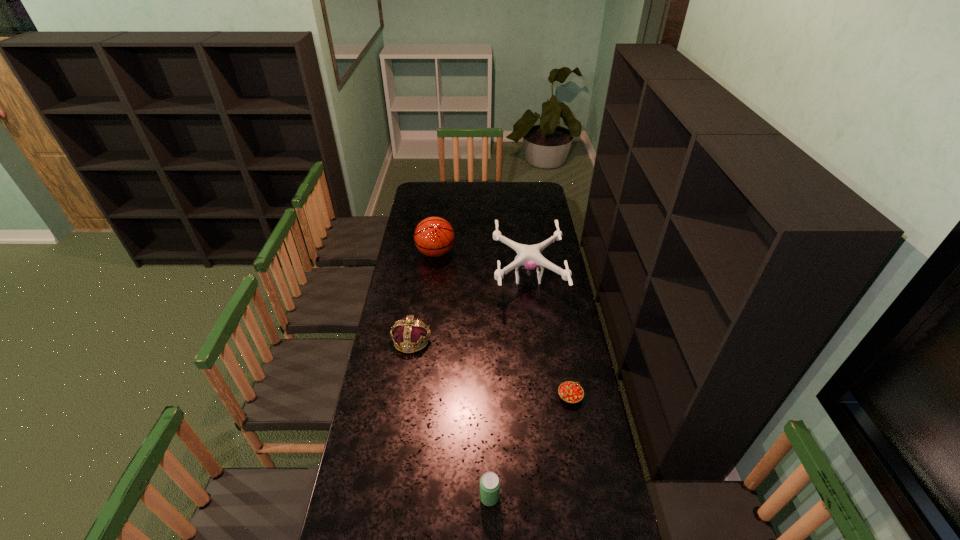
The height and width of the screenshot is (540, 960). What are the coordinates of `vacant area that lies between the fourth farthest object and the drone` in the screenshot? It's located at (549, 337).

Find the location of a particular element. This screenshot has width=960, height=540. free space between the third object from right to left and the drone is located at coordinates (509, 387).

This screenshot has width=960, height=540. I want to click on object that is the fourth closest to the second nearest object, so click(434, 236).

Find the location of a particular element. object that stands as the second closest to the shortest object is located at coordinates (528, 257).

You are a GUI agent. You are given a task and a screenshot of the screen. Output one action in this format:
    pyautogui.click(x=<x>, y=<y>)
    Task: Click on the free location that satisfies the following two spatial constraints: 1. on the top of the second tallest object; 2. on the right side of the strawberry
    This screenshot has height=540, width=960.
    Given the screenshot: What is the action you would take?
    pyautogui.click(x=542, y=396)

Find the location of a particular element. The image size is (960, 540). vacant space that satisfies the following two spatial constraints: 1. on the side with spill of the second nearest object; 2. on the left side of the tallest object is located at coordinates (419, 396).

This screenshot has width=960, height=540. In order to click on free point that satisfies the following two spatial constraints: 1. on the front side of the third farthest object; 2. on the left side of the strawberry in this screenshot , I will do `click(403, 396)`.

The width and height of the screenshot is (960, 540). I want to click on vacant space that satisfies the following two spatial constraints: 1. on the top of the fourth shortest object; 2. on the back side of the shortest object, so click(542, 396).

This screenshot has height=540, width=960. Identify the location of free spot that satisfies the following two spatial constraints: 1. on the front side of the crown; 2. on the right side of the third object from right to left. (388, 497).